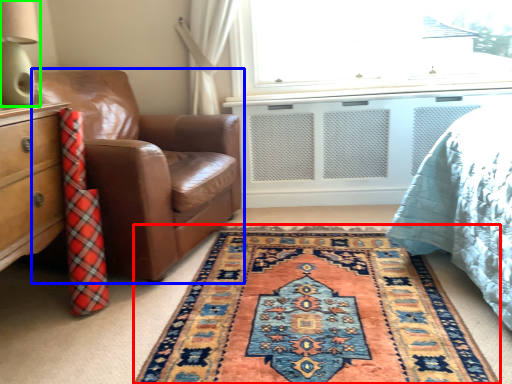
Question: Which object is the closest to the mat (highlighted by a red box)? Choose among these: chair (highlighted by a blue box) or table lamp (highlighted by a green box).

Choices:
 (A) chair
 (B) table lamp

Answer: (A)